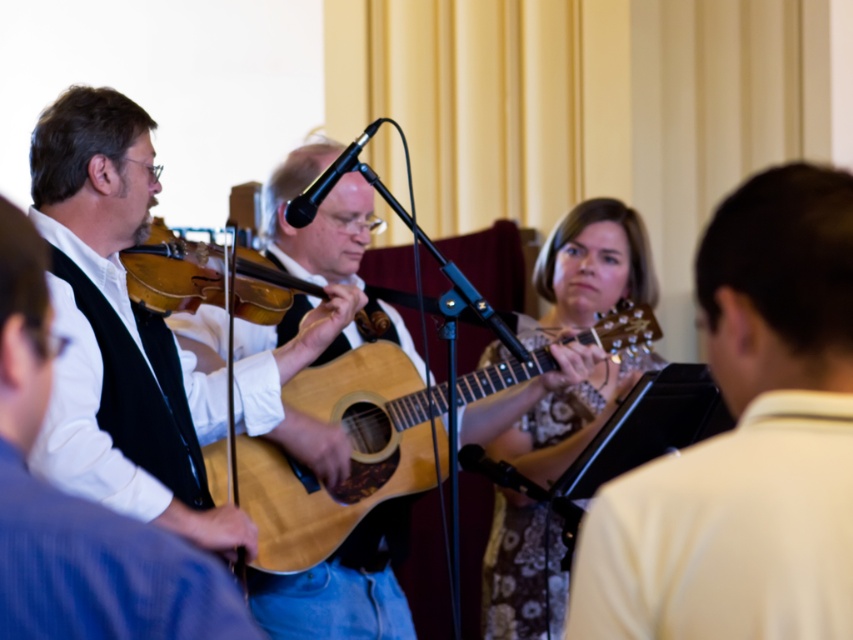
You are a photographer positioned to the side of the stage. You need to capture a shot that includes both the matte black violin at left and the wooden acoustic guitar at center. Based on their positions, which instrument should you focus on first to ensure both are in frame?

The matte black violin at left is located below the wooden acoustic guitar at center. To include both in the frame, focus on the wooden acoustic guitar at center first, then adjust to include the violin positioned below it.

You are a photographer setting up for a live music session. You need to place a microphone stand that takes up 1 meter of space between the light brown acoustic guitar at center and the wooden acoustic guitar at center. Can the space between them accommodate the stand?

The light brown acoustic guitar at center is wider than the wooden acoustic guitar at center, but the description does not provide the exact distance between them. Therefore, it is unclear if the 1 meter space is available.

You are a photographer setting up for a live performance. You need to position a microphone stand that is 1.2 meters tall. The stand must be placed between the matte black violin at left and the wooden acoustic guitar at center. Considering their heights, will the microphone stand be taller than both instruments when placed there?

The matte black violin at left has a lesser height compared to wooden acoustic guitar at center. Since the microphone stand is 1.2 meters tall, it will be taller than both instruments if the tallest instrument is shorter than 1.2 meters. However, the exact heights of the instruments are not provided, so we cannot definitively confirm. But based on typical instrument sizes, acoustic guitars are usually around 1 meter tall, so the stand would likely be taller than both.